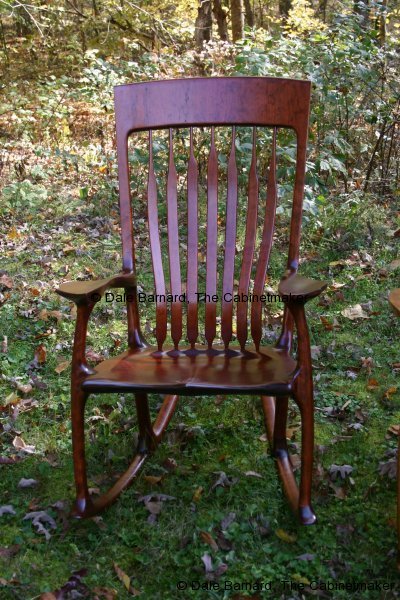
In order to click on reflections of seat back on chair seat in this screenshot , I will do `click(161, 357)`, `click(179, 352)`, `click(194, 353)`, `click(208, 353)`, `click(228, 354)`, `click(243, 354)`, `click(266, 359)`, `click(129, 359)`.